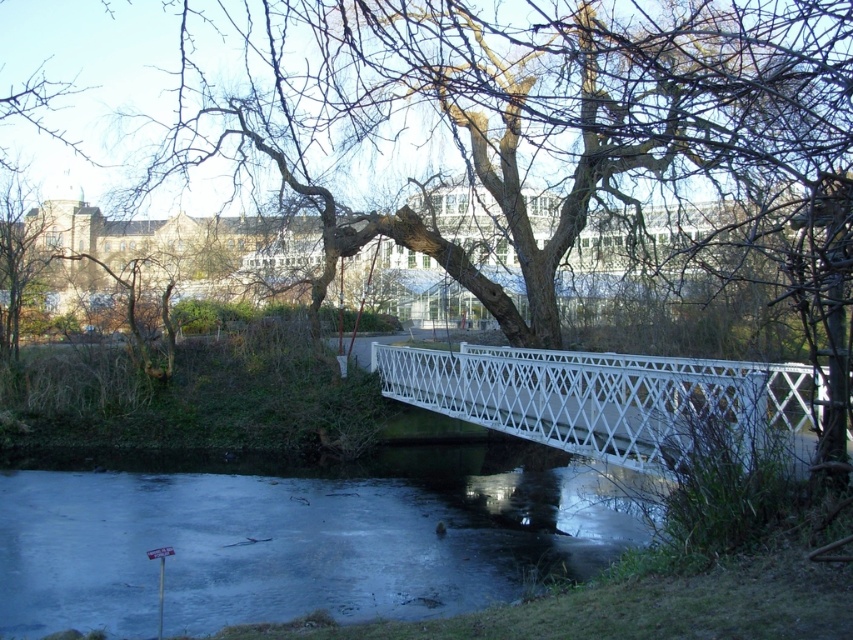
Question: Which point is closer to the camera?

Choices:
 (A) white lattice bridge at center
 (B) frozen ice at lower center

Answer: (A)

Question: Which point appears farthest from the camera in this image?

Choices:
 (A) (753, 419)
 (B) (341, 488)

Answer: (B)

Question: Is frozen ice at lower center further to camera compared to white lattice bridge at center?

Choices:
 (A) no
 (B) yes

Answer: (B)

Question: Is frozen ice at lower center further to the viewer compared to white lattice bridge at center?

Choices:
 (A) no
 (B) yes

Answer: (B)

Question: Does frozen ice at lower center appear over white lattice bridge at center?

Choices:
 (A) yes
 (B) no

Answer: (B)